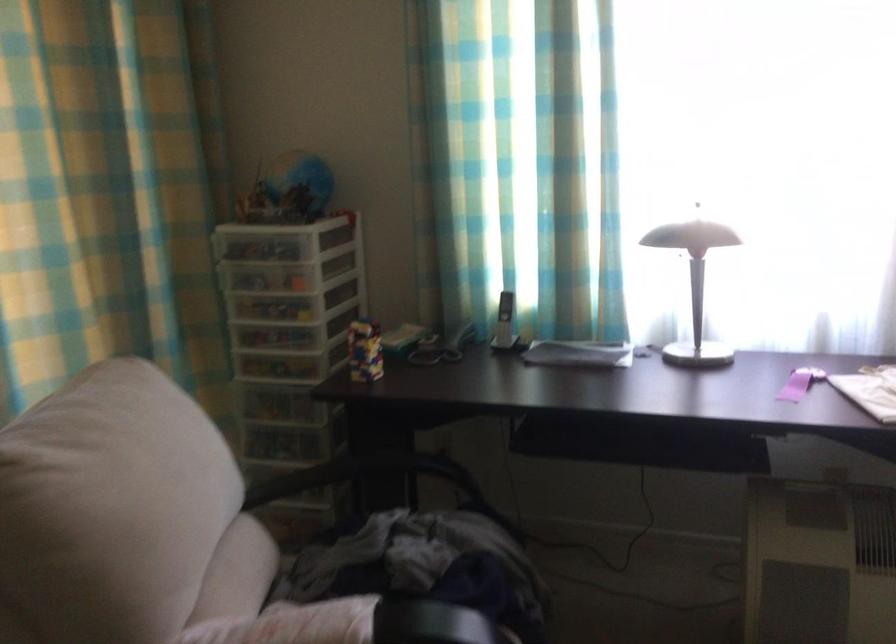
Find where to lift the colorful block toy. Please return your answer as a coordinate pair (x, y).

(365, 351)